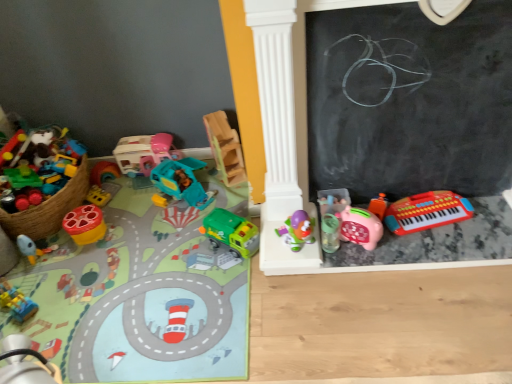
I want to click on empty space that is in between green plastic toy truck at center, placed as the eighth toy when sorted from left to right, and shiny plastic toy at left, the tenth toy positioned from the right, so click(x=155, y=237).